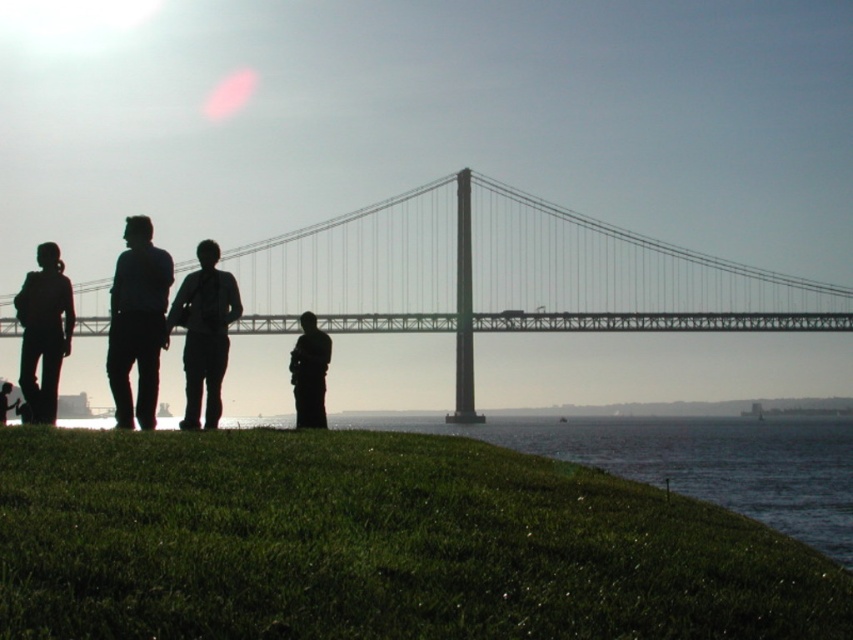
Between green grassy hill at lower center and silhouette figure at lower left, which one is positioned lower?

green grassy hill at lower center

Who is positioned more to the right, green grassy hill at lower center or silhouette figure at lower left?

green grassy hill at lower center

Between point (750, 524) and point (0, 397), which one is positioned behind?

Point (0, 397)

Where is `green grassy hill at lower center`? Image resolution: width=853 pixels, height=640 pixels. green grassy hill at lower center is located at coordinates (376, 545).

Does matte black shirt at left have a larger size compared to silhouette backpack at left?

Yes, matte black shirt at left is bigger than silhouette backpack at left.

Between point (129, 264) and point (30, 410), which one is positioned behind?

The point (129, 264) is behind.

Is point (113, 332) closer to camera compared to point (56, 356)?

No.

Locate an element on the screen. Image resolution: width=853 pixels, height=640 pixels. matte black shirt at left is located at coordinates (137, 323).

Is silhouette backpack at left smaller than silhouette figure at lower left?

Actually, silhouette backpack at left might be larger than silhouette figure at lower left.

Does silhouette backpack at left lie behind silhouette figure at lower left?

Yes.

You are a GUI agent. You are given a task and a screenshot of the screen. Output one action in this format:
    pyautogui.click(x=<x>, y=<y>)
    Task: Click on the silhouette backpack at left
    
    Given the screenshot: What is the action you would take?
    pyautogui.click(x=44, y=330)